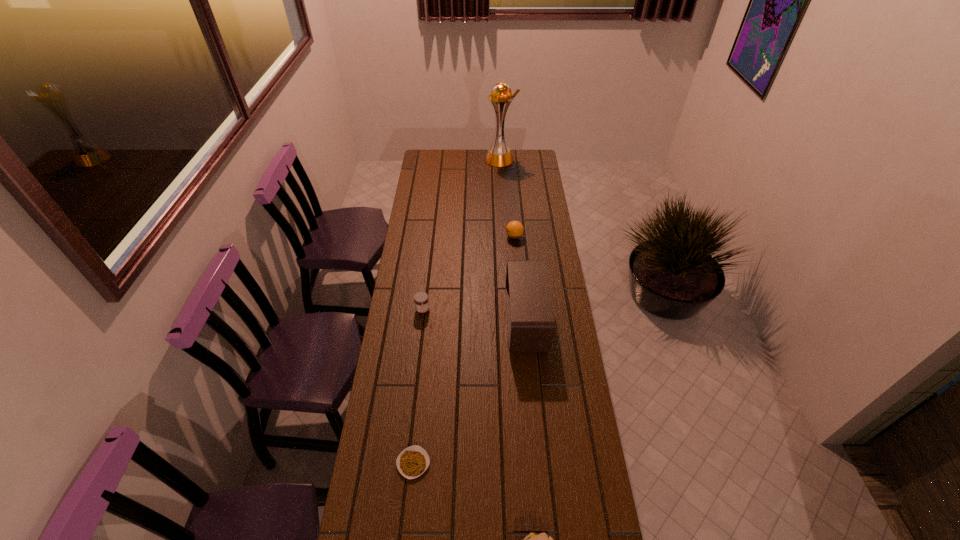
Find the location of a particular element. The image size is (960, 540). legume located at the left edge is located at coordinates (412, 462).

Identify the location of trophy that is at the right edge. This screenshot has height=540, width=960. (499, 155).

This screenshot has height=540, width=960. What are the coordinates of `radio receiver present at the right edge` in the screenshot? It's located at (531, 325).

Where is `ping-pong ball situated at the right edge`? ping-pong ball situated at the right edge is located at coordinates (514, 229).

Identify the location of object that is at the far right corner. tap(499, 155).

This screenshot has width=960, height=540. Identify the location of vacant space at the far edge. (452, 171).

The width and height of the screenshot is (960, 540). Identify the location of vacant space at the left edge. point(389,525).

Image resolution: width=960 pixels, height=540 pixels. In the image, there is a desktop. What are the coordinates of `free space at the right edge` in the screenshot? It's located at (538, 383).

Image resolution: width=960 pixels, height=540 pixels. I want to click on vacant area at the far right corner of the desktop, so click(x=519, y=150).

The width and height of the screenshot is (960, 540). I want to click on free area in between the legume and the jam, so click(418, 387).